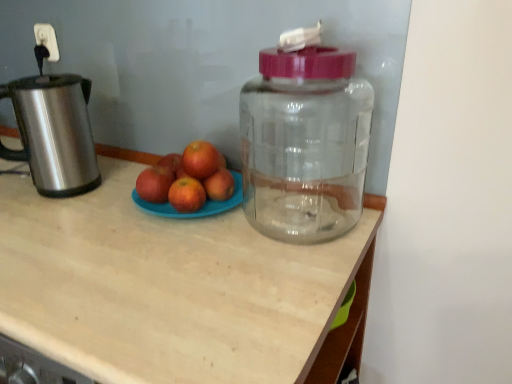
The width and height of the screenshot is (512, 384). What are the coordinates of `vacant space underneath transparent plastic bottle at center (from a real-world perspective)` in the screenshot? It's located at (306, 219).